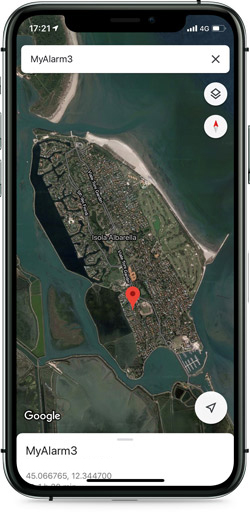
The image size is (250, 512). In order to click on grey trim in this screenshot , I will do [x=239, y=469], [x=188, y=490], [x=62, y=493], [x=9, y=413], [x=239, y=411], [x=240, y=226], [x=241, y=34], [x=176, y=7], [x=10, y=207].